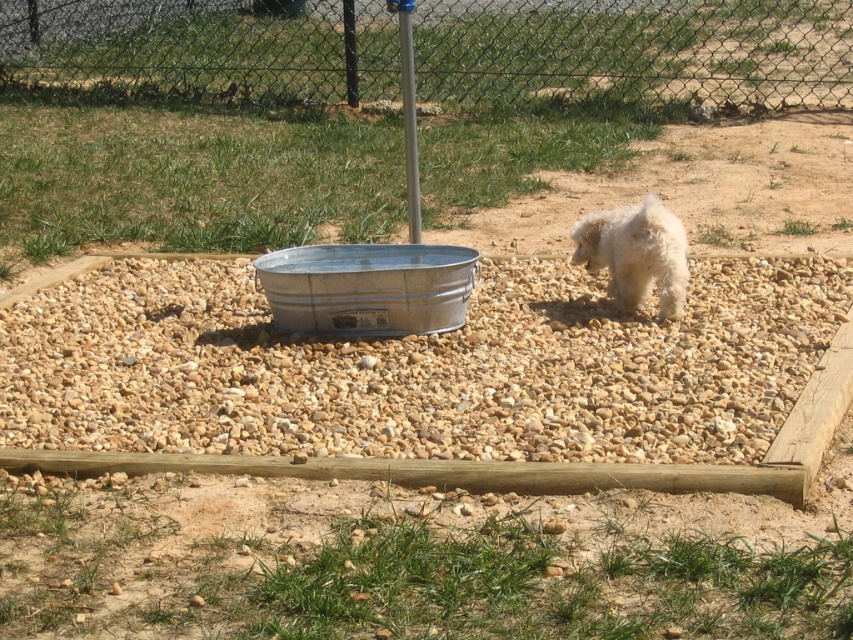
Does point (215, 451) come farther from viewer compared to point (274, 282)?

No, (215, 451) is in front of (274, 282).

Find the location of a particular element. Image resolution: width=853 pixels, height=640 pixels. gray gravel at center is located at coordinates (416, 368).

Does gray gravel at center appear on the left side of metal mesh fence at upper center?

Indeed, gray gravel at center is positioned on the left side of metal mesh fence at upper center.

Between gray gravel at center and metal mesh fence at upper center, which one appears on the left side from the viewer's perspective?

gray gravel at center

Measure the distance between point (305, 442) and camera.

Point (305, 442) and camera are 4.47 meters apart from each other.

What are the coordinates of `gray gravel at center` in the screenshot? It's located at (416, 368).

The image size is (853, 640). Identify the location of gray gravel at center. (416, 368).

Can you confirm if gray gravel at center is positioned above white fluffy dog at right?

No.

Measure the distance between gray gravel at center and camera.

The distance of gray gravel at center from camera is 4.19 meters.

You are a GUI agent. You are given a task and a screenshot of the screen. Output one action in this format:
    pyautogui.click(x=<x>, y=<y>)
    Task: Click on the gray gravel at center
    The image size is (853, 640).
    Given the screenshot: What is the action you would take?
    pyautogui.click(x=416, y=368)